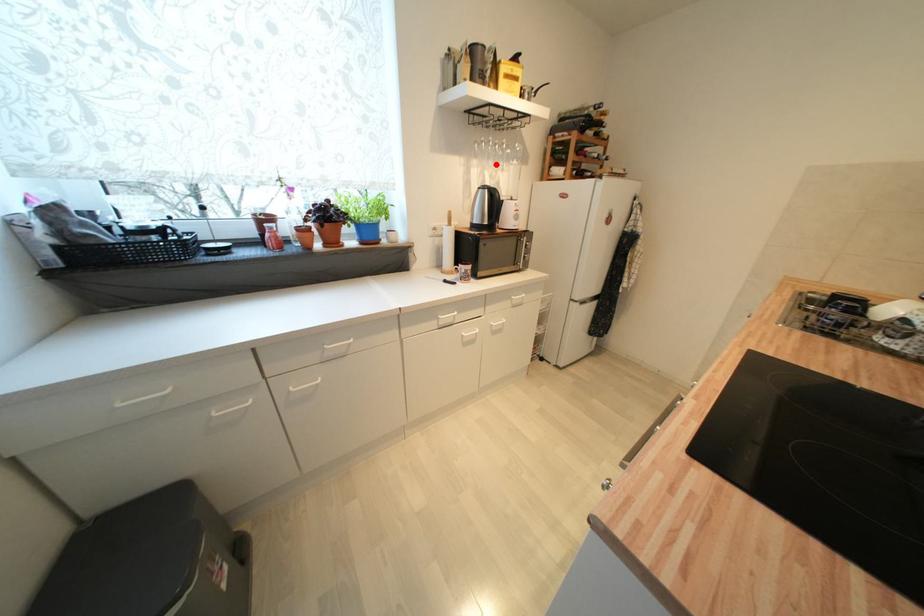
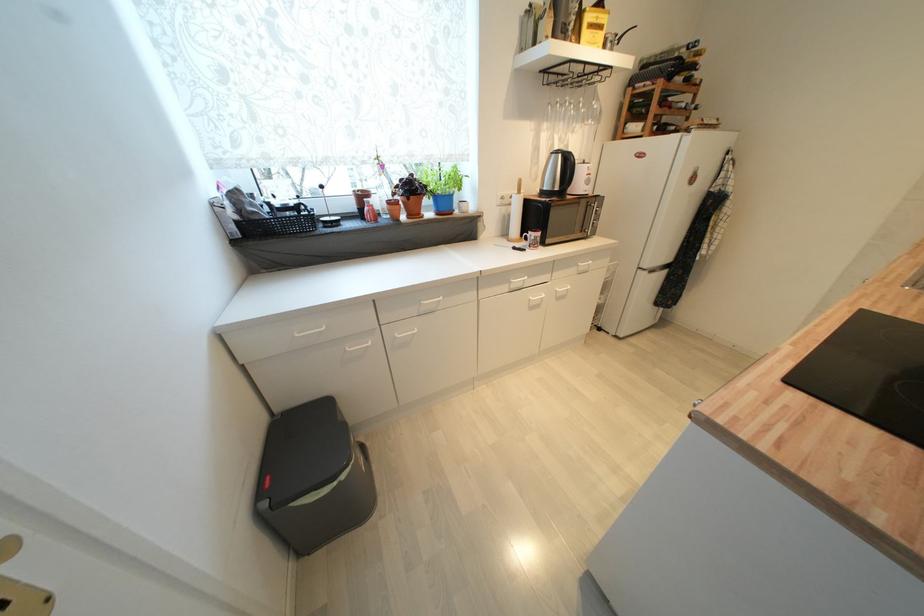
Where in the second image is the point corresponding to the highlighted location from the first image?

(566, 127)